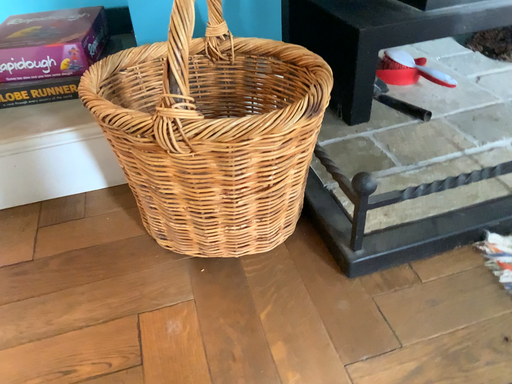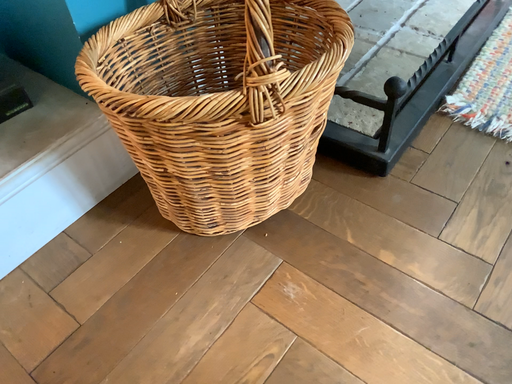
Question: How did the camera likely rotate when shooting the video?

Choices:
 (A) rotated left
 (B) rotated right

Answer: (B)